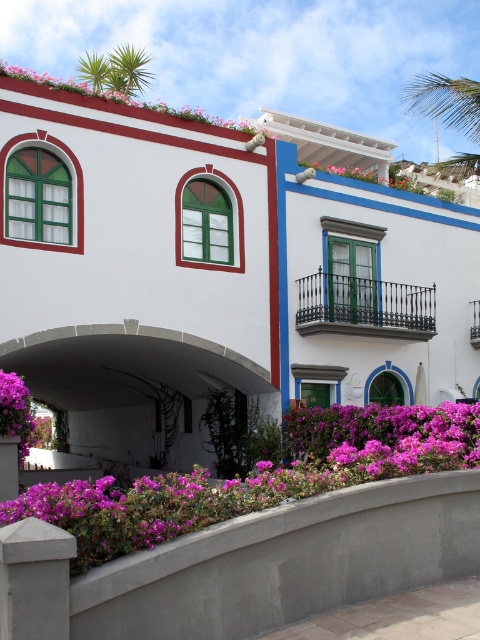
You are a gardener who wants to plant a new flower bed. You observe the purple matte flowers at lower left and the purple matte flowers at center in the image. Which of these two flower clusters is taller?

The purple matte flowers at lower left has a greater height compared to the purple matte flowers at center, so the purple matte flowers at lower left is taller.

You are standing at the entrance of the building on the left. You want to walk to the door of the building on the right. Which direction should you move relative to the white concrete archway at center?

To reach the door of the building on the right from the entrance of the building on the left, you should move towards the white concrete archway at center, as it is located between them at coordinates point (128, 381).

In the architectural scene, there are two sets of purple matte flowers. One is located at the lower left and the other at the center. From an observer standing in front of the buildings, which direction would the purple matte flowers at lower left be relative to the purple matte flowers at center?

The purple matte flowers at lower left are positioned to the left of the purple matte flowers at center.